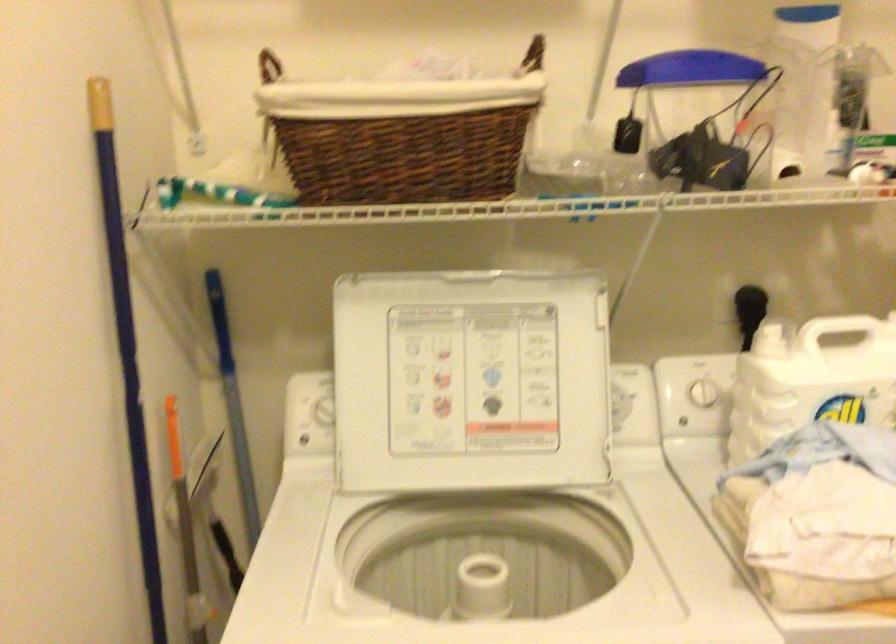
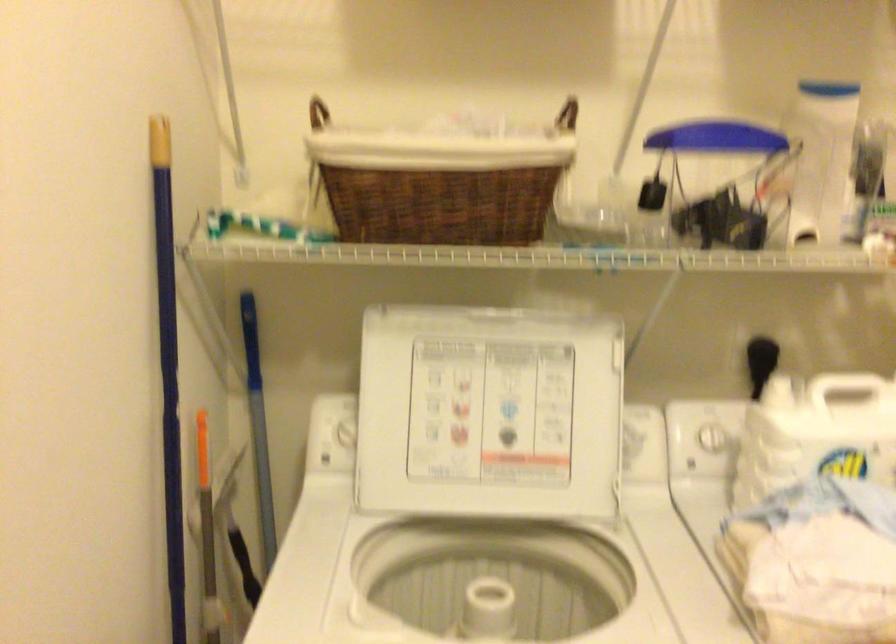
Locate, in the second image, the point that corresponds to pixel 747 313 in the first image.

(760, 362)